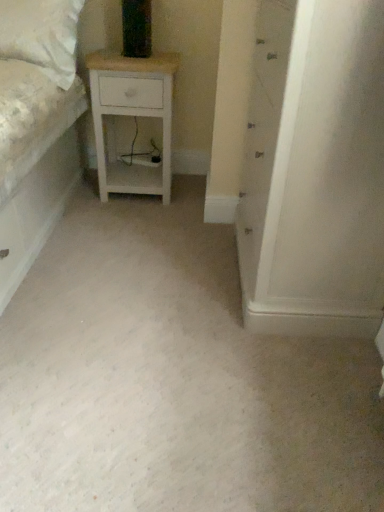
Measure the distance between white matte cabinet at center and camera.

white matte cabinet at center and camera are 34.87 inches apart.

What do you see at coordinates (315, 170) in the screenshot? The height and width of the screenshot is (512, 384). I see `white matte cabinet at center` at bounding box center [315, 170].

Locate an element on the screen. This screenshot has width=384, height=512. white matte cabinet at center is located at coordinates [x=315, y=170].

What do you see at coordinates (131, 116) in the screenshot? I see `white wood nightstand at center` at bounding box center [131, 116].

In order to face white wood nightstand at center, should I rotate leftwards or rightwards?

Rotate left and turn 6.851 degrees.

At what (x,y) coordinates should I click in order to perform the action: click on white wood nightstand at center. Please return your answer as a coordinate pair (x, y). This screenshot has height=512, width=384. Looking at the image, I should click on (131, 116).

The height and width of the screenshot is (512, 384). I want to click on white matte cabinet at center, so click(x=315, y=170).

Considering the relative positions of white matte cabinet at center and white wood nightstand at center in the image provided, is white matte cabinet at center to the left of white wood nightstand at center from the viewer's perspective?

In fact, white matte cabinet at center is to the right of white wood nightstand at center.

Looking at this image, which is in front, white matte cabinet at center or white wood nightstand at center?

white matte cabinet at center is closer to the camera.

Is point (370, 38) in front of point (117, 98)?

Yes, it is in front of point (117, 98).

From the image's perspective, would you say white matte cabinet at center is shown under white wood nightstand at center?

Yes, from the image's perspective, white matte cabinet at center is below white wood nightstand at center.

From a real-world perspective, is white matte cabinet at center positioned over white wood nightstand at center based on gravity?

Correct, in the physical world, white matte cabinet at center is higher than white wood nightstand at center.

Does white matte cabinet at center have a greater width compared to white wood nightstand at center?

Yes, white matte cabinet at center is wider than white wood nightstand at center.

Which of these two, white matte cabinet at center or white wood nightstand at center, stands shorter?

Standing shorter between the two is white wood nightstand at center.

Based on their sizes in the image, would you say white matte cabinet at center is bigger or smaller than white wood nightstand at center?

Considering their sizes, white matte cabinet at center takes up more space than white wood nightstand at center.

Would you say white matte cabinet at center is inside or outside white wood nightstand at center?

white matte cabinet at center cannot be found inside white wood nightstand at center.

Is white matte cabinet at center not close to white wood nightstand at center?

Yes, white matte cabinet at center is far from white wood nightstand at center.

Is white matte cabinet at center positioned with its back to white wood nightstand at center?

No, white matte cabinet at center is not facing away from white wood nightstand at center.

The height and width of the screenshot is (512, 384). I want to click on nightstand located on the left of white matte cabinet at center, so click(131, 116).

Does white wood nightstand at center appear on the right side of white matte cabinet at center?

No, white wood nightstand at center is not to the right of white matte cabinet at center.

Which object is further away from the camera, white wood nightstand at center or white matte cabinet at center?

Positioned behind is white wood nightstand at center.

Which point is more forward, (109,174) or (340,109)?

The point (340,109) is in front.

From the image's perspective, which one is positioned lower, white wood nightstand at center or white matte cabinet at center?

white matte cabinet at center appears lower in the image.

From a real-world perspective, who is located higher, white wood nightstand at center or white matte cabinet at center?

white matte cabinet at center, from a real-world perspective.

Between white wood nightstand at center and white matte cabinet at center, which one has smaller width?

Thinner between the two is white wood nightstand at center.

Looking at this image, can you confirm if white wood nightstand at center is shorter than white matte cabinet at center?

Yes, white wood nightstand at center is shorter than white matte cabinet at center.

Can you confirm if white wood nightstand at center is smaller than white matte cabinet at center?

Correct, white wood nightstand at center occupies less space than white matte cabinet at center.

Is white matte cabinet at center a part of white wood nightstand at center?

No.

Is white wood nightstand at center far away from white matte cabinet at center?

Absolutely, white wood nightstand at center is distant from white matte cabinet at center.

Is white wood nightstand at center positioned with its back to white matte cabinet at center?

Result: No, white wood nightstand at center is not facing away from white matte cabinet at center.

How many degrees apart are the facing directions of white wood nightstand at center and white matte cabinet at center?

They differ by 90 degrees in their facing directions.

How far apart are white wood nightstand at center and white matte cabinet at center?

white wood nightstand at center and white matte cabinet at center are 1.03 meters apart from each other.

Identify the location of nightstand on the left of the white matte cabinet at center. This screenshot has height=512, width=384. (131, 116).

The width and height of the screenshot is (384, 512). I want to click on nightstand on the left of white matte cabinet at center, so click(131, 116).

Locate an element on the screen. The image size is (384, 512). nightstand behind the white matte cabinet at center is located at coordinates (131, 116).